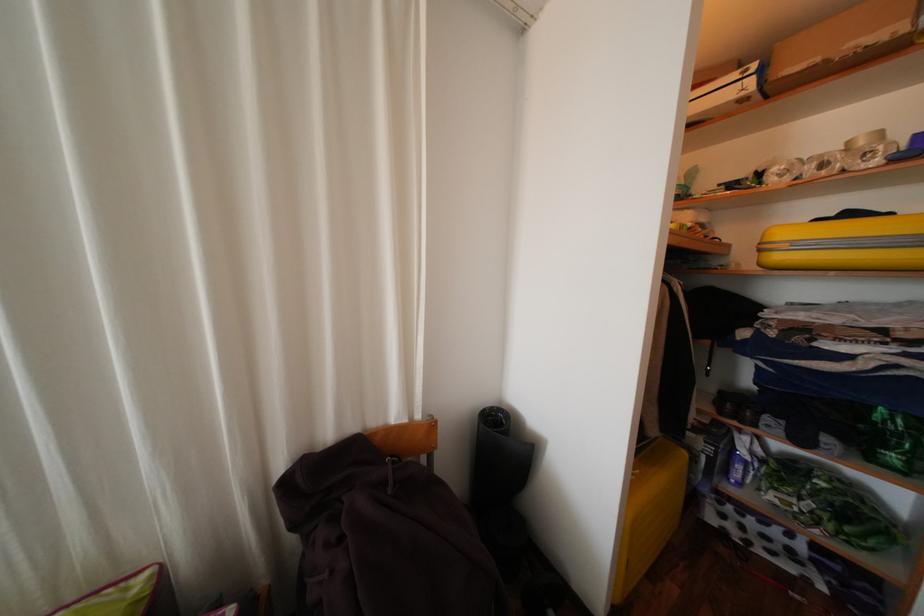
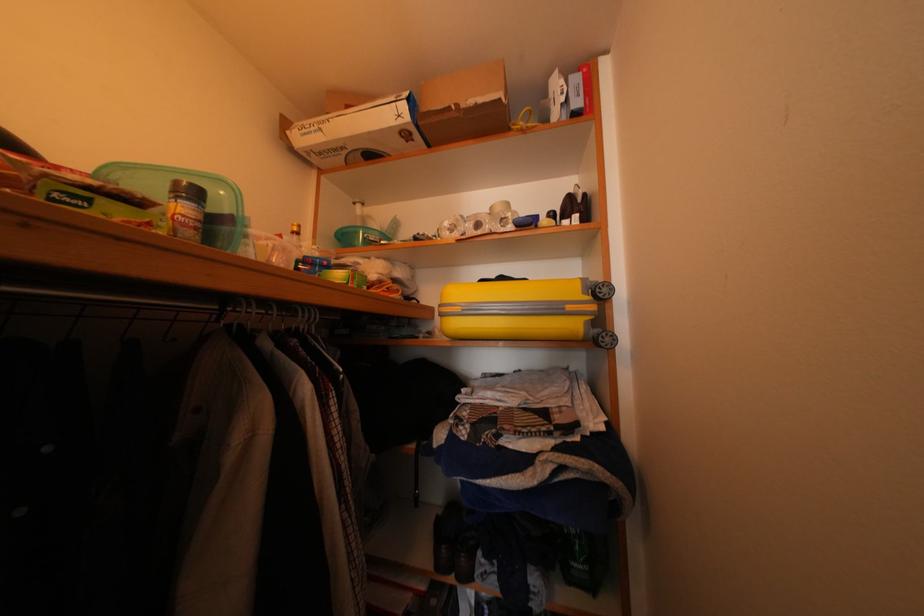
Question: The camera is either moving clockwise (left) or counter-clockwise (right) around the object. The first image is from the beginning of the video and the second image is from the end. Is the camera moving left or right when shooting the video?

Choices:
 (A) Left
 (B) Right

Answer: (A)